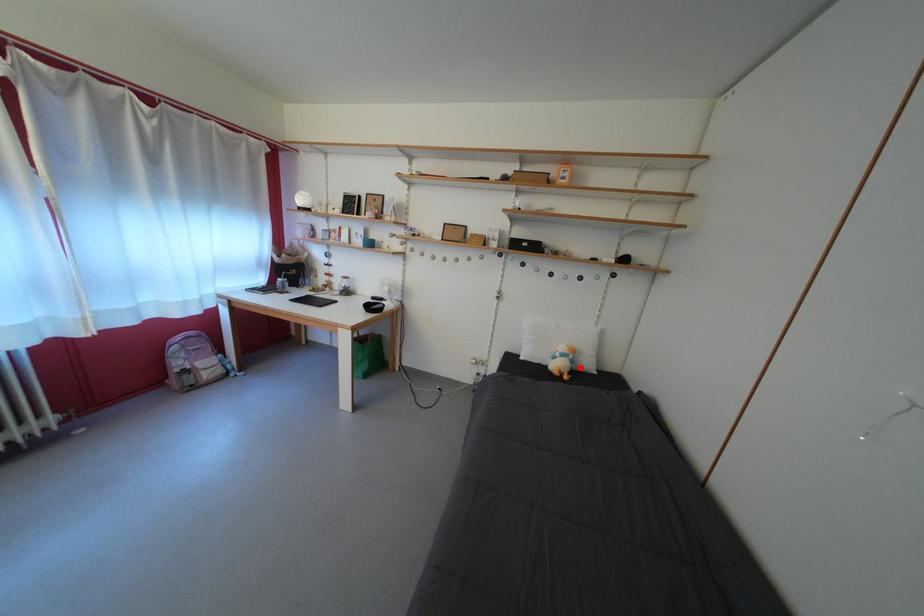
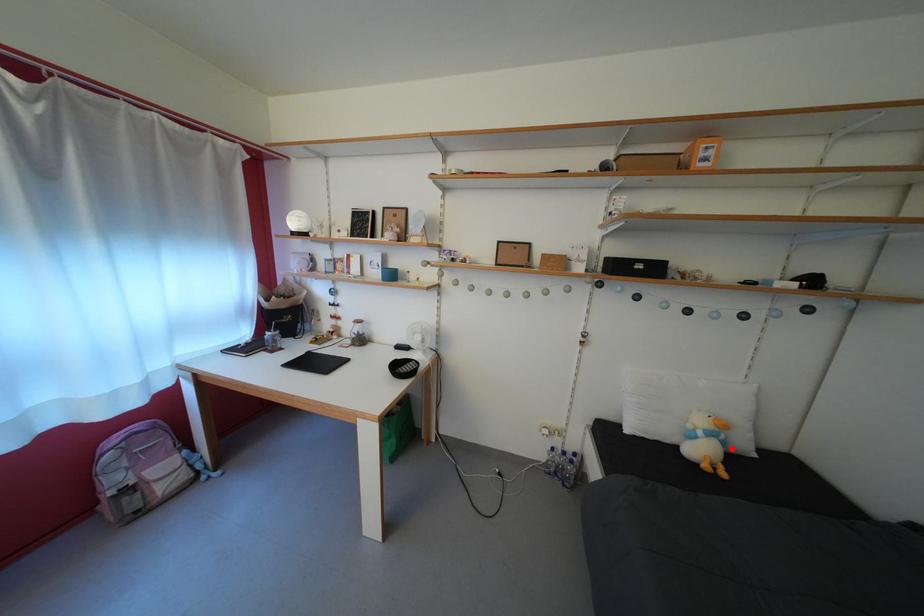
I am providing you with two images of the same scene from different viewpoints. A red point is marked on the first image and another point is marked on the second image. Do the highlighted points in image1 and image2 indicate the same real-world spot?

Yes